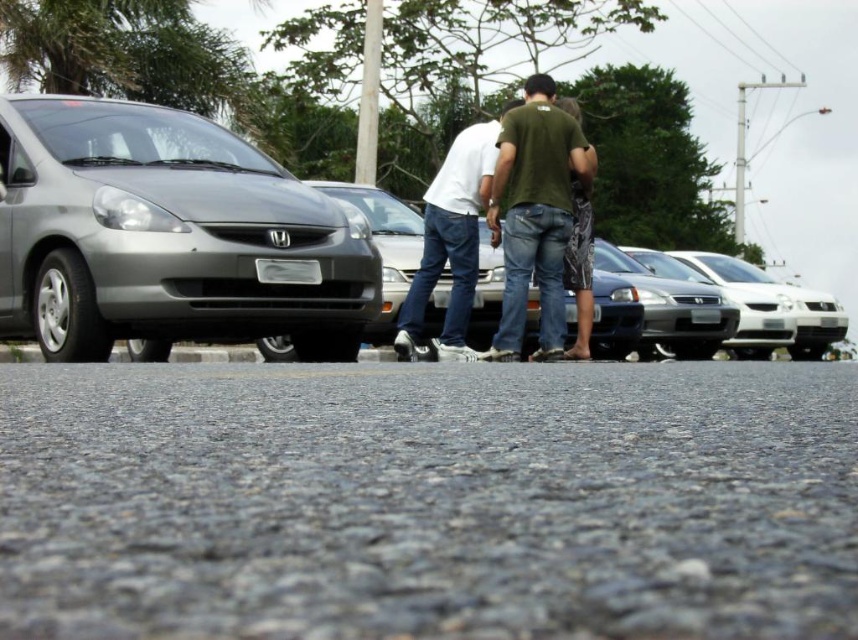
Measure the distance between satin silver car at center and camera.

satin silver car at center is 3.31 meters from camera.

Is point (221, 157) farther from viewer compared to point (726, 330)?

No, it is in front of (726, 330).

The width and height of the screenshot is (858, 640). In order to click on satin silver car at center in this screenshot , I will do `click(225, 300)`.

Is point (68, 378) less distant than point (388, 250)?

Yes.

Can you confirm if gray asphalt at center is positioned to the left of silver metallic sedan at center?

In fact, gray asphalt at center is to the right of silver metallic sedan at center.

This screenshot has height=640, width=858. Describe the element at coordinates (429, 500) in the screenshot. I see `gray asphalt at center` at that location.

Find the location of a particular element. gray asphalt at center is located at coordinates (429, 500).

Between point (149, 240) and point (514, 280), which one is positioned in front?

Positioned in front is point (149, 240).

Between point (125, 131) and point (520, 280), which one is positioned in front?

Positioned in front is point (125, 131).

Find the location of a particular element. The image size is (858, 640). satin silver car at left is located at coordinates (168, 236).